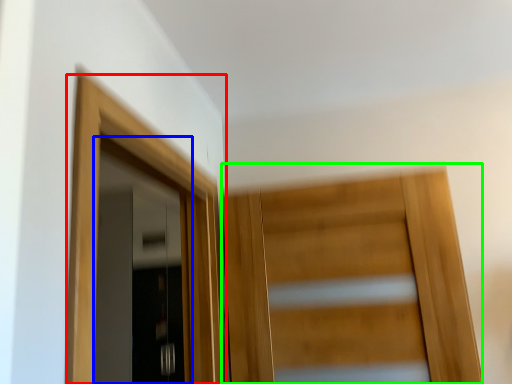
Question: Considering the real-world distances, which object is closest to door (highlighted by a red box)? door (highlighted by a blue box) or door (highlighted by a green box).

Choices:
 (A) door
 (B) door

Answer: (B)